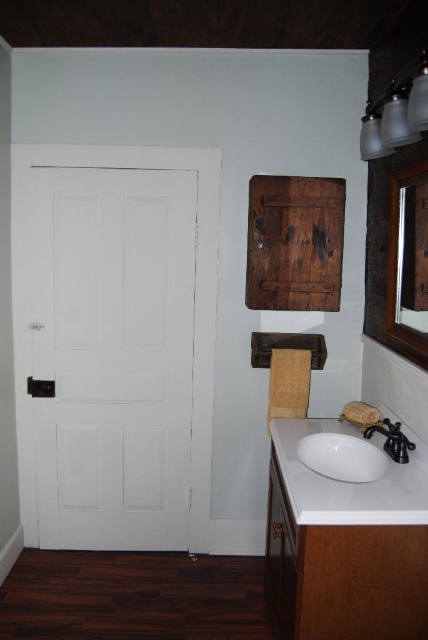
You are standing in the bathroom and want to adjust the black matte faucet at lower right. However, the wooden mirror at upper right is blocking your view. Can you reach the faucet without moving the mirror?

The wooden mirror at upper right is in front of the black matte faucet at lower right, so you cannot see or reach the faucet directly without moving the mirror.

You are standing in the bathroom and want to exit through the door. Which object should you approach first, the white matte door at left or the wooden mirror at upper right?

You should approach the white matte door at left first because it is positioned to the left of the wooden mirror at upper right, meaning it is closer to you from your current position in the bathroom.

You are a delivery person with a package that is 1.5 meters long. You need to move it through the bathroom from the white matte door at left to the black matte faucet at lower right. Can you fit the package through the space between them without bending it?

The distance between the white matte door at left and the black matte faucet at lower right is 1.27 meters. Since the package is 1.5 meters long, which is longer than the available space, it cannot fit through the space between them without bending.